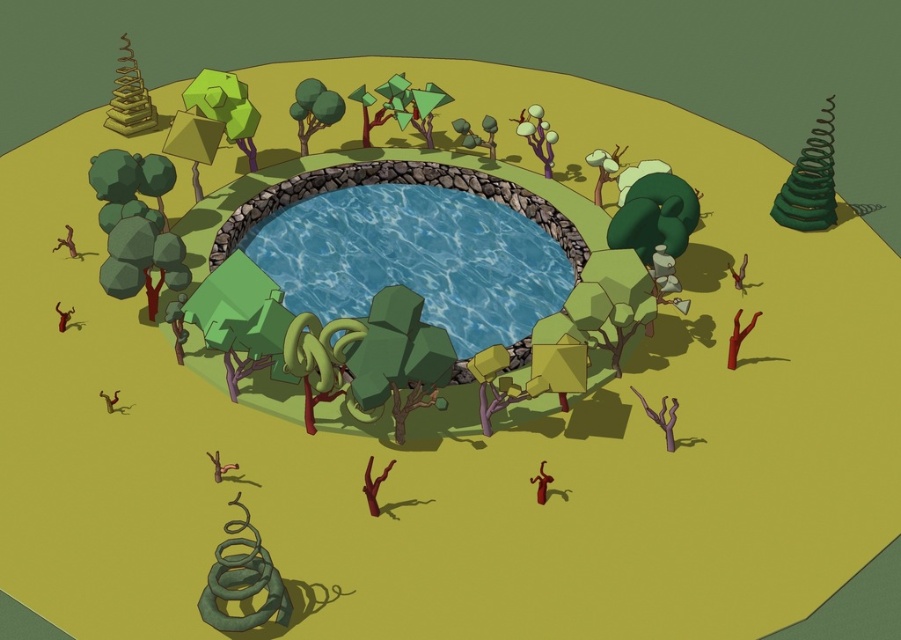
You are a small red figure standing on the yellow terrain. You want to reach the green matte spiral at upper right but need to avoid getting wet. Can you walk directly from your current position to the spiral without crossing the blue glossy pond at center?

The blue glossy pond at center is positioned on the left side of the green matte spiral at upper right, so the path between them might require crossing the pond. Since the pond is in the center and to the left of the spiral, you would have to go around it to avoid getting wet. Therefore, you cannot walk directly to the spiral without crossing the pond.

From the picture: You are standing in the landscape and see the blue glossy pond at center and the dark green matte tree at left. Which object is positioned to the right of the other?

The blue glossy pond at center is to the right of the dark green matte tree at left.